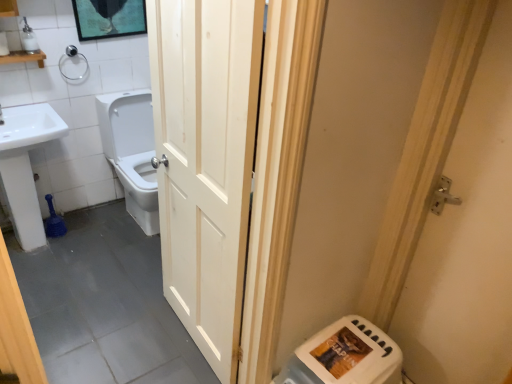
Locate an element on the screen. This screenshot has width=512, height=384. vacant area situated below white ceramic sink at left (from a real-world perspective) is located at coordinates (34, 246).